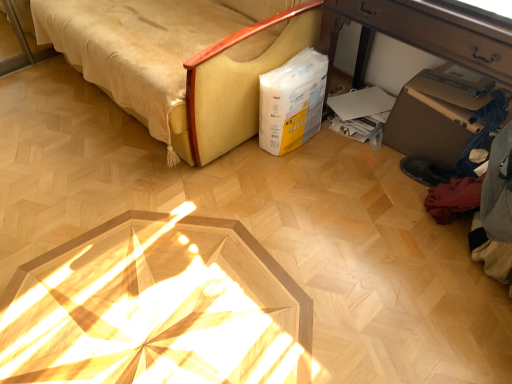
This screenshot has height=384, width=512. I want to click on free space to the left of wooden desk at lower right, so click(292, 181).